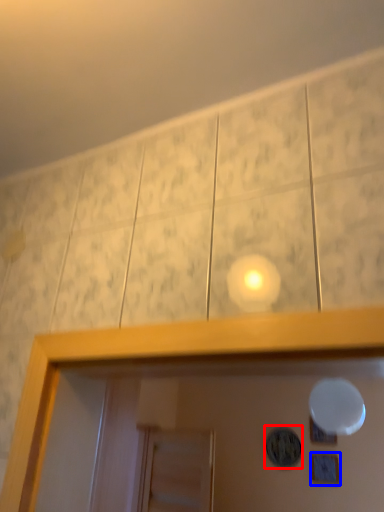
Question: Which of the following is the closest to the observer, dot (highlighted by a red box) or picture frame (highlighted by a blue box)?

Choices:
 (A) dot
 (B) picture frame

Answer: (B)